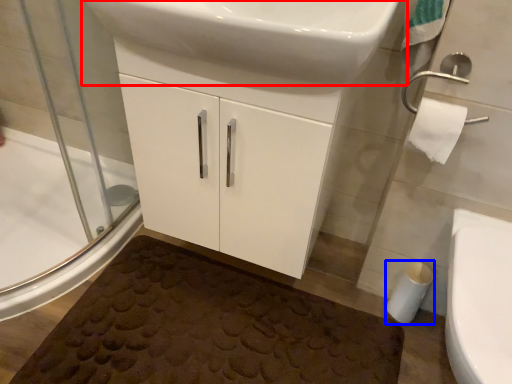
Question: Which point is further to the camera, sink (highlighted by a red box) or toilet paper (highlighted by a blue box)?

Choices:
 (A) sink
 (B) toilet paper

Answer: (B)